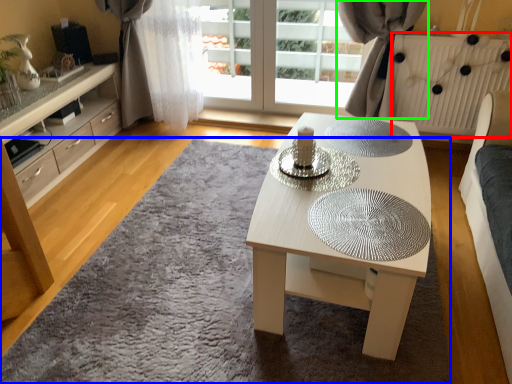
Question: Which object is the farthest from radiator (highlighted by a red box)? Choose among these: mat (highlighted by a blue box) or curtain (highlighted by a green box).

Choices:
 (A) mat
 (B) curtain

Answer: (A)